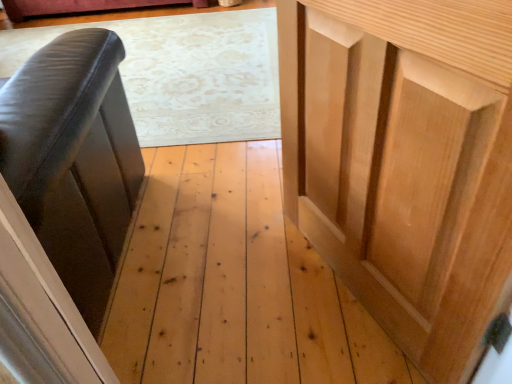
Question: Does natural wood cupboard at right have a greater height compared to black leather couch at left?

Choices:
 (A) no
 (B) yes

Answer: (A)

Question: Does natural wood cupboard at right have a smaller size compared to black leather couch at left?

Choices:
 (A) no
 (B) yes

Answer: (B)

Question: Is natural wood cupboard at right positioned before black leather couch at left?

Choices:
 (A) yes
 (B) no

Answer: (A)

Question: Can you confirm if natural wood cupboard at right is wider than black leather couch at left?

Choices:
 (A) yes
 (B) no

Answer: (B)

Question: From the image's perspective, is natural wood cupboard at right above black leather couch at left?

Choices:
 (A) yes
 (B) no

Answer: (B)

Question: Is natural wood cupboard at right not within black leather couch at left?

Choices:
 (A) yes
 (B) no

Answer: (A)

Question: Can we say black leather couch at left lies outside natural wood cupboard at right?

Choices:
 (A) yes
 (B) no

Answer: (A)

Question: Can you confirm if black leather couch at left is thinner than natural wood cupboard at right?

Choices:
 (A) no
 (B) yes

Answer: (A)

Question: Can you confirm if black leather couch at left is smaller than natural wood cupboard at right?

Choices:
 (A) yes
 (B) no

Answer: (B)

Question: Is natural wood cupboard at right located within black leather couch at left?

Choices:
 (A) yes
 (B) no

Answer: (B)

Question: Is black leather couch at left positioned far away from natural wood cupboard at right?

Choices:
 (A) no
 (B) yes

Answer: (A)

Question: Does black leather couch at left have a greater height compared to natural wood cupboard at right?

Choices:
 (A) no
 (B) yes

Answer: (B)

Question: Relative to black leather couch at left, is natural wood cupboard at right in front or behind?

Choices:
 (A) behind
 (B) front

Answer: (B)